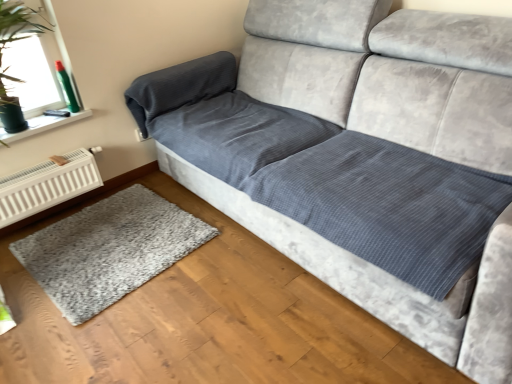
Image resolution: width=512 pixels, height=384 pixels. Find the location of `white metallic radiator at lower left`. white metallic radiator at lower left is located at coordinates click(x=47, y=185).

Find the location of a particular element. This screenshot has width=512, height=384. gray shaggy rug at lower left is located at coordinates (109, 250).

In the scene shown: Is transparent glass window at upper left inside or outside of gray shaggy rug at lower left?

transparent glass window at upper left is outside gray shaggy rug at lower left.

Is transparent glass window at upper left thinner than gray shaggy rug at lower left?

Indeed, transparent glass window at upper left has a lesser width compared to gray shaggy rug at lower left.

Is transparent glass window at upper left bigger than gray shaggy rug at lower left?

Correct, transparent glass window at upper left is larger in size than gray shaggy rug at lower left.

Is the position of transparent glass window at upper left more distant than that of gray shaggy rug at lower left?

Yes, transparent glass window at upper left is further from the camera.

Considering the sizes of objects transparent glass window at upper left and white metallic radiator at lower left in the image provided, who is thinner, transparent glass window at upper left or white metallic radiator at lower left?

Thinner between the two is white metallic radiator at lower left.

Choose the correct answer: Is transparent glass window at upper left inside white metallic radiator at lower left or outside it?

The correct answer is: outside.

Is transparent glass window at upper left taller than white metallic radiator at lower left?

Indeed, transparent glass window at upper left has a greater height compared to white metallic radiator at lower left.

From a real-world perspective, who is located higher, transparent glass window at upper left or white metallic radiator at lower left?

In real-world perspective, transparent glass window at upper left is above.

Can you see gray shaggy rug at lower left touching transparent glass window at upper left?

No, gray shaggy rug at lower left is not beside transparent glass window at upper left.

From the picture: Would you say gray shaggy rug at lower left is inside or outside transparent glass window at upper left?

gray shaggy rug at lower left is located beyond the bounds of transparent glass window at upper left.

You are a GUI agent. You are given a task and a screenshot of the screen. Output one action in this format:
    pyautogui.click(x=<x>, y=<y>)
    Task: Click on the window screen that appears on the left of gray shaggy rug at lower left
    The height and width of the screenshot is (384, 512).
    Given the screenshot: What is the action you would take?
    pyautogui.click(x=15, y=37)

Consider the image. Can you tell me how much gray shaggy rug at lower left and transparent glass window at upper left differ in facing direction?

They differ by 87.9 degrees in their facing directions.

Can you tell me how much gray shaggy rug at lower left and white metallic radiator at lower left differ in facing direction?

There is a 85.3-degree angle between the facing directions of gray shaggy rug at lower left and white metallic radiator at lower left.

Which is in front, point (66, 254) or point (85, 160)?

The point (66, 254) is more forward.

Consider the image. Between gray shaggy rug at lower left and white metallic radiator at lower left, which one has larger size?

gray shaggy rug at lower left.

This screenshot has width=512, height=384. What are the coordinates of `mat in front of the white metallic radiator at lower left` in the screenshot? It's located at (109, 250).

Are white metallic radiator at lower left and gray shaggy rug at lower left far apart?

That's not correct — white metallic radiator at lower left is a little close to gray shaggy rug at lower left.

Could you tell me if white metallic radiator at lower left is turned towards gray shaggy rug at lower left?

No, white metallic radiator at lower left is not aimed at gray shaggy rug at lower left.

From the image's perspective, is white metallic radiator at lower left located above or below transparent glass window at upper left?

white metallic radiator at lower left is below transparent glass window at upper left.

How many degrees apart are the facing directions of white metallic radiator at lower left and transparent glass window at upper left?

They differ by 2.58 degrees in their facing directions.

Which of these two, white metallic radiator at lower left or transparent glass window at upper left, stands shorter?

white metallic radiator at lower left.

From a real-world perspective, is white metallic radiator at lower left below transparent glass window at upper left?

Yes, from a real-world perspective, white metallic radiator at lower left is below transparent glass window at upper left.

This screenshot has width=512, height=384. In order to click on mat lying in front of the transparent glass window at upper left in this screenshot , I will do `click(109, 250)`.

This screenshot has height=384, width=512. I want to click on window screen that appears above the white metallic radiator at lower left (from a real-world perspective), so click(15, 37).

When comparing their distances from gray shaggy rug at lower left, does white metallic radiator at lower left or transparent glass window at upper left seem further?

transparent glass window at upper left is positioned further to the anchor gray shaggy rug at lower left.

Estimate the real-world distances between objects in this image. Which object is further from white metallic radiator at lower left, gray shaggy rug at lower left or transparent glass window at upper left?

gray shaggy rug at lower left lies further to white metallic radiator at lower left than the other object.

When comparing their distances from gray shaggy rug at lower left, does transparent glass window at upper left or white metallic radiator at lower left seem closer?

Among the two, white metallic radiator at lower left is located nearer to gray shaggy rug at lower left.

Which object lies nearer to the anchor point white metallic radiator at lower left, transparent glass window at upper left or gray shaggy rug at lower left?

transparent glass window at upper left is closer to white metallic radiator at lower left.

Looking at the image, which one is located closer to transparent glass window at upper left, gray shaggy rug at lower left or white metallic radiator at lower left?

Based on the image, white metallic radiator at lower left appears to be nearer to transparent glass window at upper left.

Which object lies further to the anchor point transparent glass window at upper left, white metallic radiator at lower left or gray shaggy rug at lower left?

gray shaggy rug at lower left lies further to transparent glass window at upper left than the other object.

The height and width of the screenshot is (384, 512). Find the location of `radiator between transparent glass window at upper left and gray shaggy rug at lower left from top to bottom`. radiator between transparent glass window at upper left and gray shaggy rug at lower left from top to bottom is located at coordinates (47, 185).